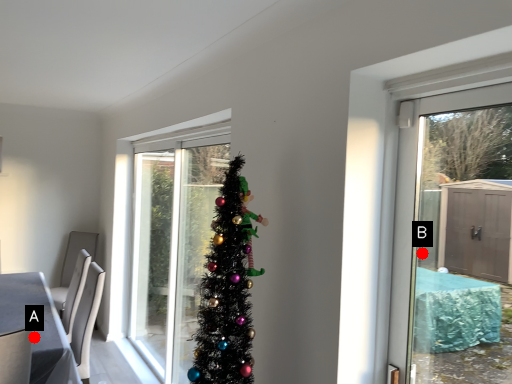
Question: Two points are circled on the image, labeled by A and B beside each circle. Which point appears closest to the camera in this image?

Choices:
 (A) A is closer
 (B) B is closer

Answer: (A)